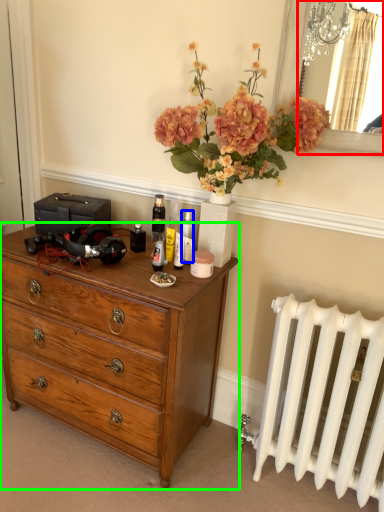
Question: Which object is positioned closest to mirror (highlighted by a red box)? Select from toiletry (highlighted by a blue box) and chest of drawers (highlighted by a green box).

Choices:
 (A) toiletry
 (B) chest of drawers

Answer: (A)